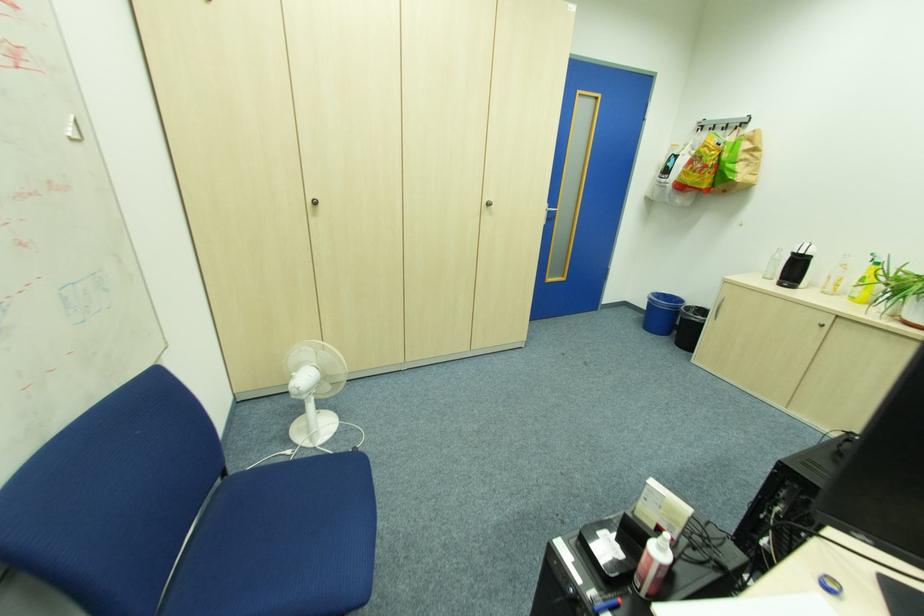
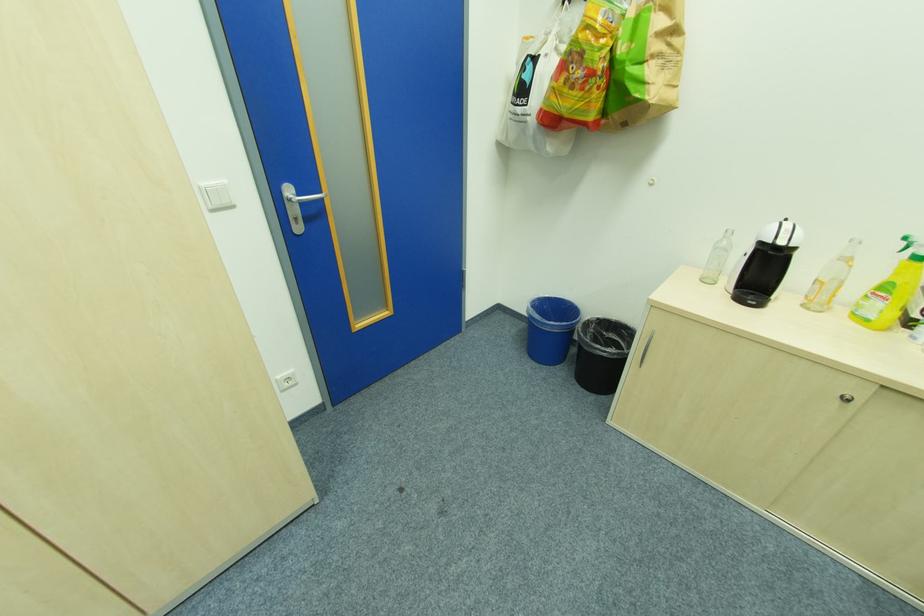
In the second image, find the point that corresponds to (554,209) in the first image.

(304, 196)